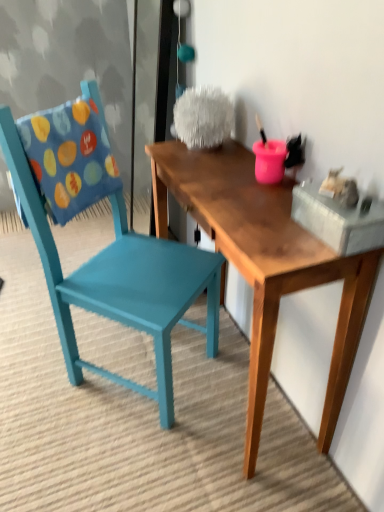
Image resolution: width=384 pixels, height=512 pixels. I want to click on vacant area situated to the left side of teal painted wood chair at left, so click(x=38, y=370).